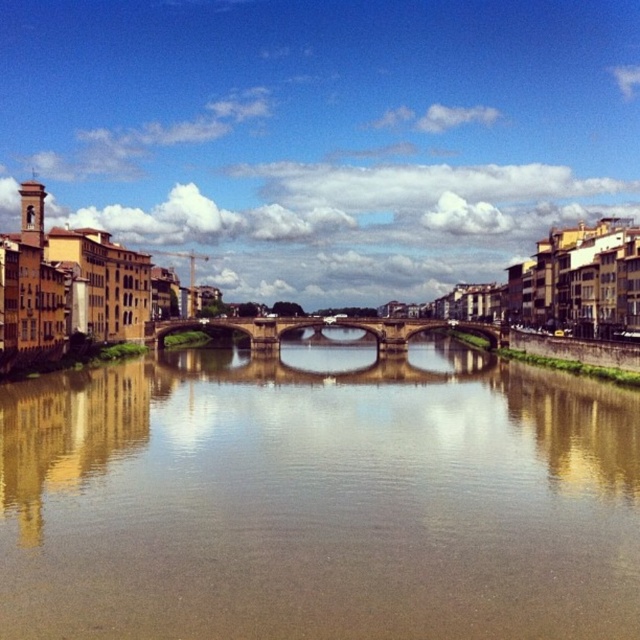
In the scene shown: You are a photographer planning to capture the entire stone arch bridge at center and the brown reflective water at center in a single frame. Based on the scene, can you fit both objects within the camera frame if the bridge is wider than the water?

The brown reflective water at center is wider than the stone arch bridge at center, so you can fit both objects within the camera frame since the water is wider than the bridge.

You are standing at the riverside and want to know how far the point at coordinates point (108,502) is from you. Can you determine the distance?

The point (108,502) is 89.23 meters away from the viewer.